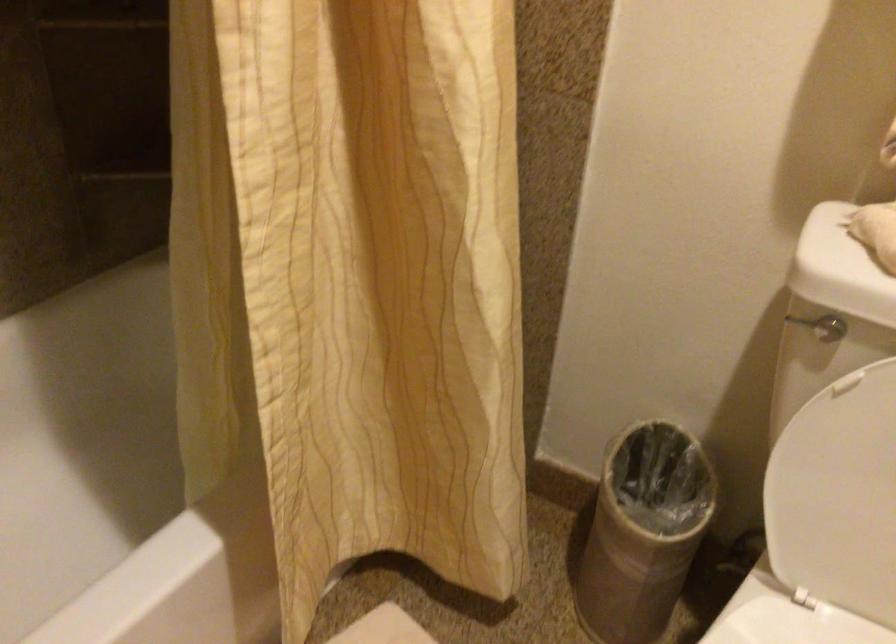
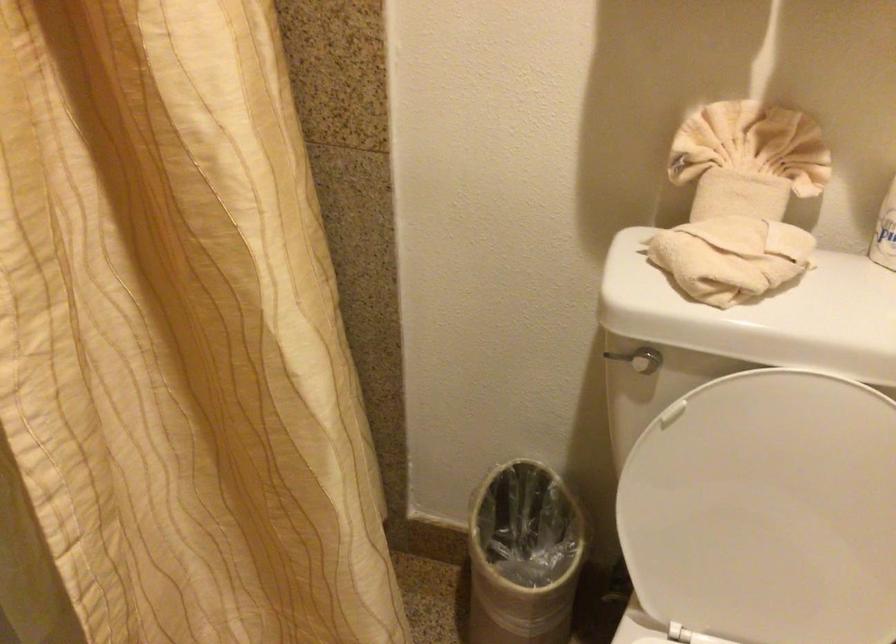
The point at (647, 511) is marked in the first image. Where is the corresponding point in the second image?

(522, 556)